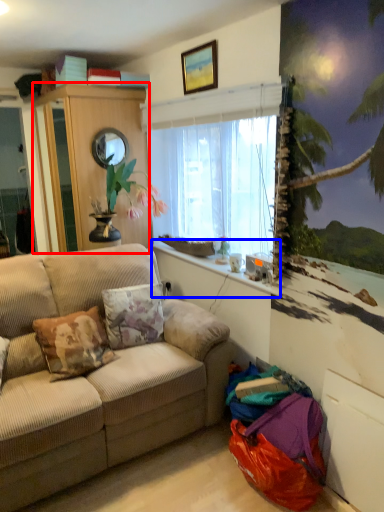
Question: Among these objects, which one is farthest to the camera, cabinetry (highlighted by a red box) or window sill (highlighted by a blue box)?

Choices:
 (A) cabinetry
 (B) window sill

Answer: (A)